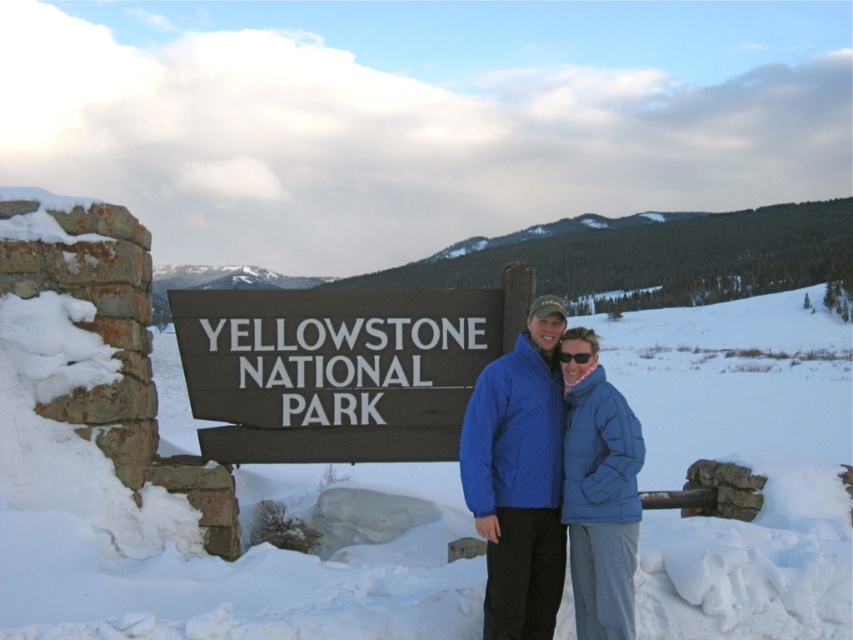
Which is in front, point (169, 356) or point (590, 486)?

Point (590, 486) is in front.

Identify the location of white powdery snow at center. The width and height of the screenshot is (853, 640). (149, 483).

Is point (444, 628) in front of point (599, 547)?

That is False.

You are a GUI agent. You are given a task and a screenshot of the screen. Output one action in this format:
    pyautogui.click(x=<x>, y=<y>)
    Task: Click on the white powdery snow at center
    
    Given the screenshot: What is the action you would take?
    pyautogui.click(x=149, y=483)

Between brown wooden sign at center and black plastic sunglasses at center, which one is positioned higher?

Positioned higher is black plastic sunglasses at center.

Can you confirm if brown wooden sign at center is positioned to the left of black plastic sunglasses at center?

Yes, brown wooden sign at center is to the left of black plastic sunglasses at center.

Identify the location of brown wooden sign at center. (334, 371).

Between white powdery snow at center and brown wooden sign at center, which one appears on the right side from the viewer's perspective?

Positioned to the right is brown wooden sign at center.

Is point (273, 588) positioned after point (479, 324)?

No, (273, 588) is in front of (479, 324).

Locate an element on the screen. The height and width of the screenshot is (640, 853). white powdery snow at center is located at coordinates (149, 483).